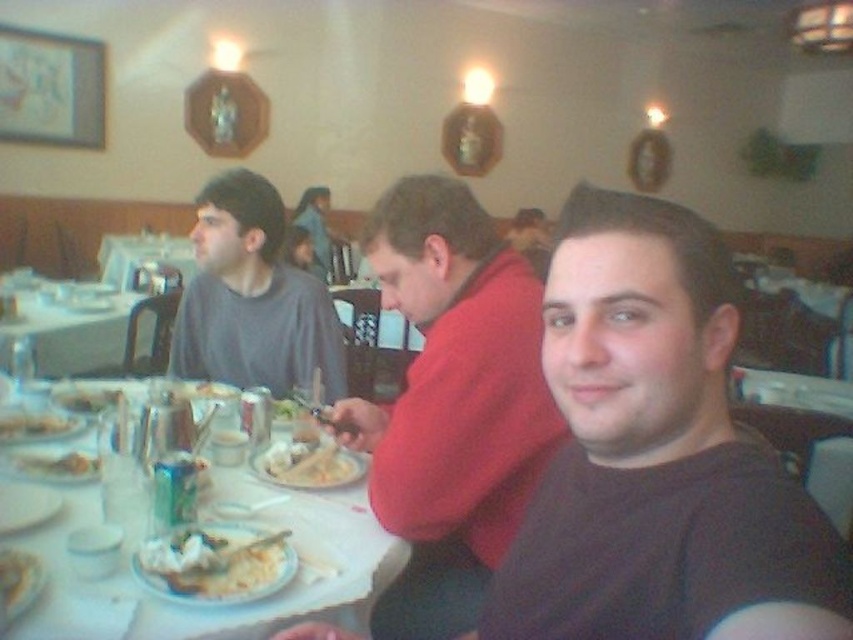
Image resolution: width=853 pixels, height=640 pixels. What are the coordinates of `dark brown shirt at center` in the screenshot? It's located at (657, 456).

Who is shorter, dark brown shirt at center or white paper plate at table left?

white paper plate at table left is shorter.

What do you see at coordinates (657, 456) in the screenshot? I see `dark brown shirt at center` at bounding box center [657, 456].

This screenshot has width=853, height=640. Identify the location of dark brown shirt at center. click(657, 456).

Does white paper plate at table left have a greater width compared to white matte plate at center?

In fact, white paper plate at table left might be narrower than white matte plate at center.

Can you confirm if white paper plate at table left is thinner than white matte plate at center?

Yes.

The width and height of the screenshot is (853, 640). What are the coordinates of `white paper plate at table left` in the screenshot? It's located at (57, 465).

Where is `white paper plate at table left`? white paper plate at table left is located at coordinates (57, 465).

Is white paper plate at center closer to camera compared to white paper plate at table left?

Yes, white paper plate at center is in front of white paper plate at table left.

Which is above, white paper plate at center or white paper plate at table left?

Positioned higher is white paper plate at table left.

Which is behind, point (107, 580) or point (73, 452)?

The point (73, 452) is behind.

Where is `white paper plate at center`? white paper plate at center is located at coordinates (219, 602).